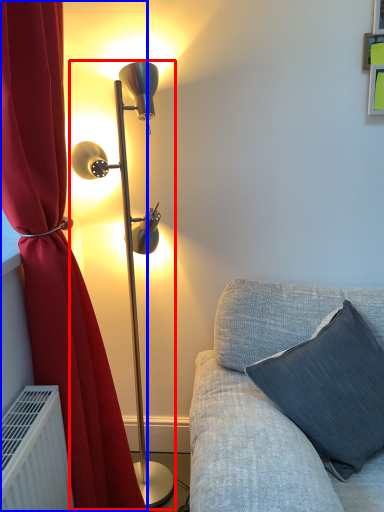
Question: Among these objects, which one is farthest to the camera, lamp (highlighted by a red box) or curtain (highlighted by a blue box)?

Choices:
 (A) lamp
 (B) curtain

Answer: (A)